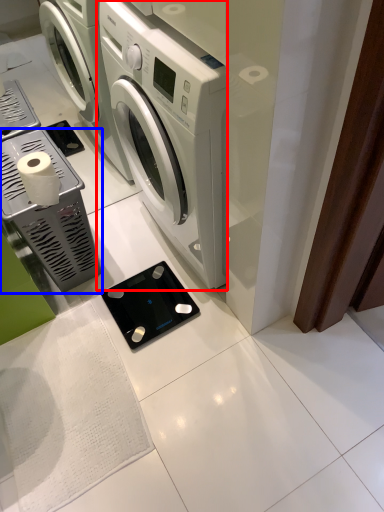
Question: Which of the following is the farthest to the observer, washing machine (highlighted by a red box) or appliance (highlighted by a blue box)?

Choices:
 (A) washing machine
 (B) appliance

Answer: (B)